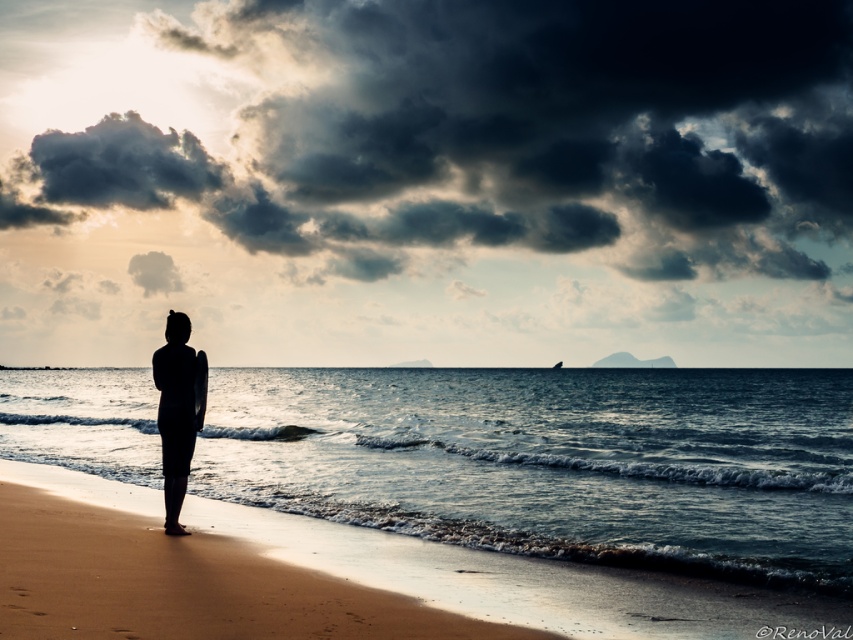
You are standing at the point marked as point (184, 584). Looking towards the sandy beach at lower left, which direction should you face to see the two small islands on the horizon?

You should face towards the horizon where the two small islands are located, which is opposite the direction of the sandy beach at lower left. Since the islands are on the horizon, facing away from the sandy beach at lower left would allow you to see them.

You are standing on the sandy beach at lower left and want to pick up the silhouette surfboard at center. In which direction should you move relative to the surfboard?

Since the sandy beach at lower left is to the right of the silhouette surfboard at center, you should move to your left to reach the surfboard.

You are planning to set up a small tent on the sandy beach at lower left for a beachside event. Given the coordinates provided in the description, can you confirm if this location is suitable for setting up the tent without obstructing the view of the horizon?

The sandy beach at lower left is located at point [184,584], which is in the lower left area of the image. Since the horizon is visible in the distance and the foreground includes the beach area, setting up the tent here should not obstruct the view of the horizon.